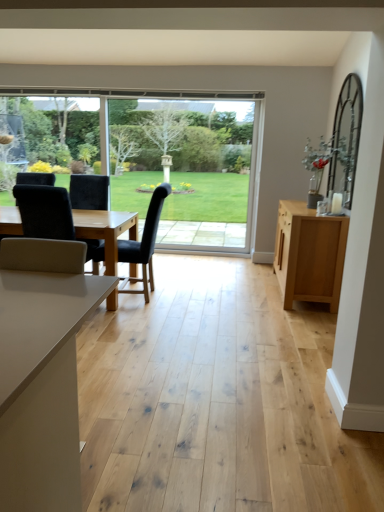
In order to click on vacant space to the right of black fabric chair at center, arranged as the 2th chair when viewed from the left in this screenshot , I will do `click(186, 300)`.